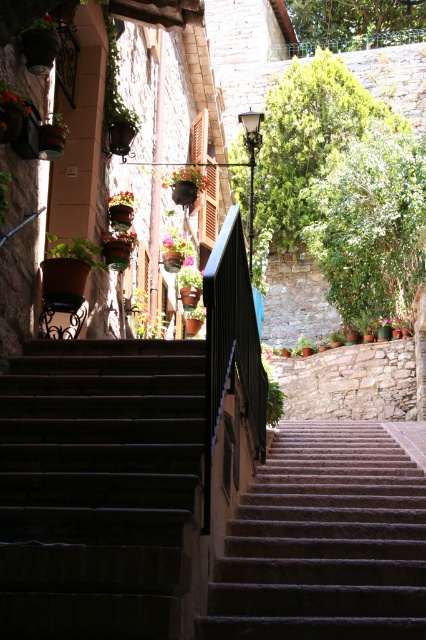
Which is behind, point (83, 403) or point (270, 456)?

Point (270, 456)

Is brown stone stairs at lower left below granite stairs at center?

Incorrect, brown stone stairs at lower left is not positioned below granite stairs at center.

Between point (74, 353) and point (376, 445), which one is positioned behind?

Positioned behind is point (376, 445).

What are the coordinates of `brown stone stairs at lower left` in the screenshot? It's located at (98, 486).

Is green leafy plant at upper center closer to camera compared to matte black pot at upper left?

No, green leafy plant at upper center is further to the viewer.

Who is more distant from viewer, [109,26] or [2,104]?

Point [109,26]

Locate an element on the screen. green leafy plant at upper center is located at coordinates (115, 77).

Describe the element at coordinates (98, 486) in the screenshot. I see `brown stone stairs at lower left` at that location.

Who is positioned more to the left, brown stone stairs at lower left or matte black pot at upper left?

matte black pot at upper left is more to the left.

Image resolution: width=426 pixels, height=640 pixels. Identify the location of brown stone stairs at lower left. (98, 486).